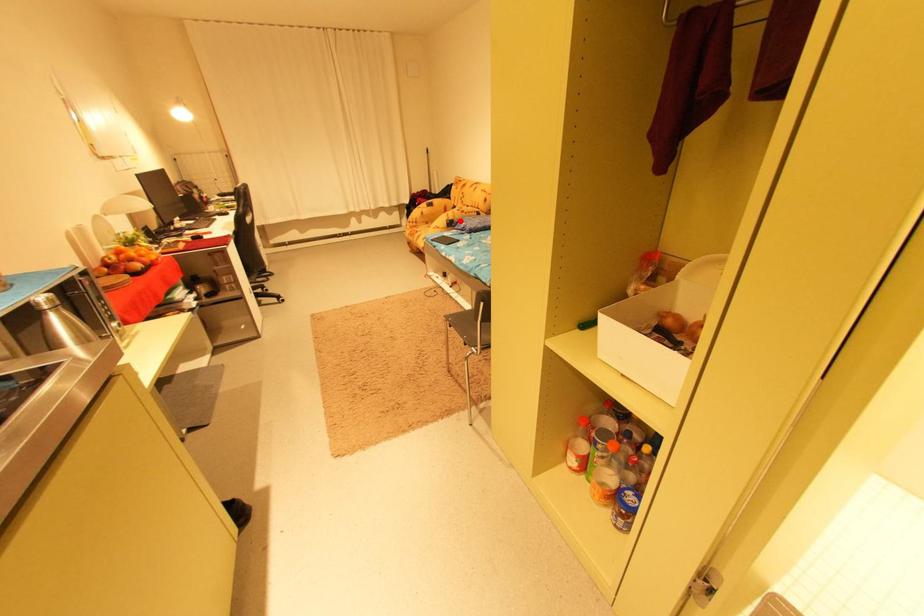
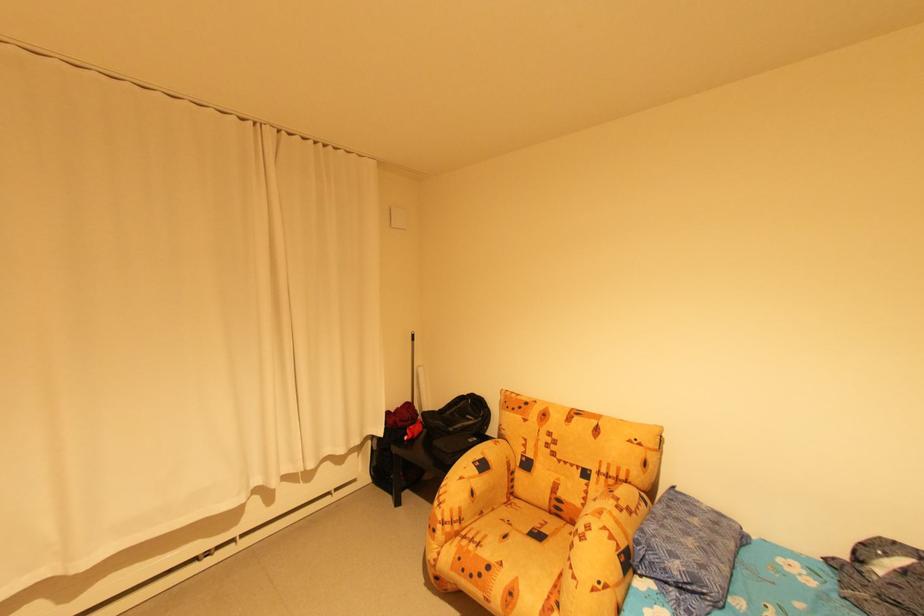
In the second image, find the point that corresponds to the highlighted location in the first image.

(636, 548)